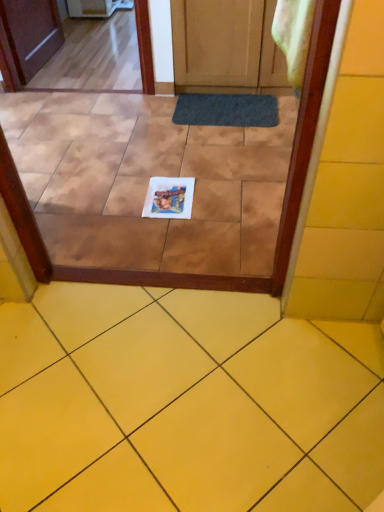
Question: From a real-world perspective, is white glossy coaster at center on dark gray rubber doormat at center?

Choices:
 (A) no
 (B) yes

Answer: (A)

Question: Is white glossy coaster at center turned away from dark gray rubber doormat at center?

Choices:
 (A) yes
 (B) no

Answer: (A)

Question: Is white glossy coaster at center not inside dark gray rubber doormat at center?

Choices:
 (A) yes
 (B) no

Answer: (A)

Question: Is white glossy coaster at center bigger than dark gray rubber doormat at center?

Choices:
 (A) yes
 (B) no

Answer: (B)

Question: Can you confirm if white glossy coaster at center is taller than dark gray rubber doormat at center?

Choices:
 (A) yes
 (B) no

Answer: (B)

Question: Considering the positions of yellow matte tile at lower center and white glossy coaster at center in the image, is yellow matte tile at lower center bigger or smaller than white glossy coaster at center?

Choices:
 (A) small
 (B) big

Answer: (B)

Question: In the image, is yellow matte tile at lower center on the left side or the right side of white glossy coaster at center?

Choices:
 (A) right
 (B) left

Answer: (A)

Question: From their relative heights in the image, would you say yellow matte tile at lower center is taller or shorter than white glossy coaster at center?

Choices:
 (A) short
 (B) tall

Answer: (B)

Question: Considering their positions, is yellow matte tile at lower center located in front of or behind white glossy coaster at center?

Choices:
 (A) front
 (B) behind

Answer: (A)

Question: From the image's perspective, is white glossy coaster at center located above or below yellow matte tile at lower center?

Choices:
 (A) below
 (B) above

Answer: (B)

Question: From a real-world perspective, is white glossy coaster at center above or below yellow matte tile at lower center?

Choices:
 (A) below
 (B) above

Answer: (A)

Question: Is white glossy coaster at center bigger or smaller than yellow matte tile at lower center?

Choices:
 (A) small
 (B) big

Answer: (A)

Question: Is white glossy coaster at center wider or thinner than yellow matte tile at lower center?

Choices:
 (A) wide
 (B) thin

Answer: (B)

Question: Considering the positions of yellow matte tile at lower center and dark gray rubber doormat at center in the image, is yellow matte tile at lower center bigger or smaller than dark gray rubber doormat at center?

Choices:
 (A) small
 (B) big

Answer: (B)

Question: Is yellow matte tile at lower center inside the boundaries of dark gray rubber doormat at center, or outside?

Choices:
 (A) outside
 (B) inside

Answer: (A)